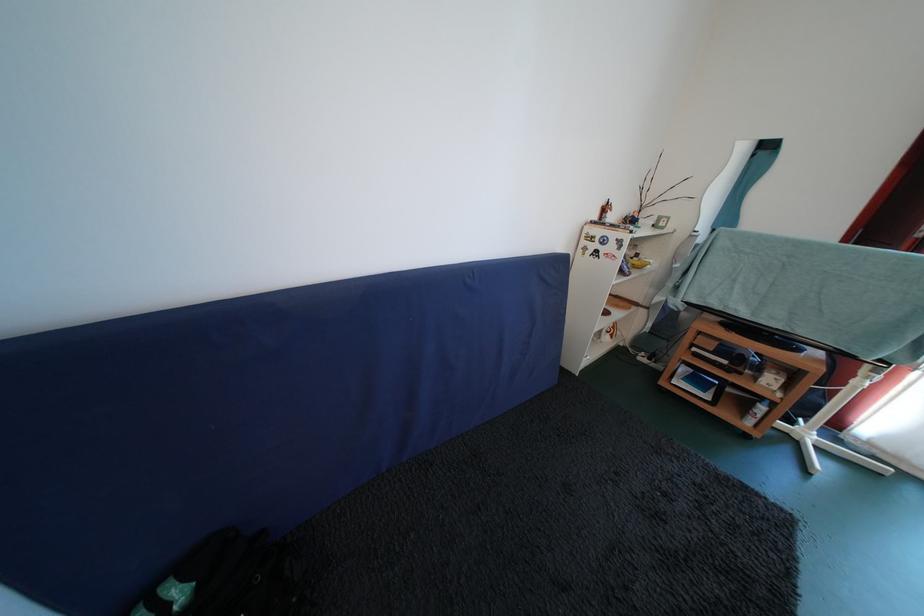
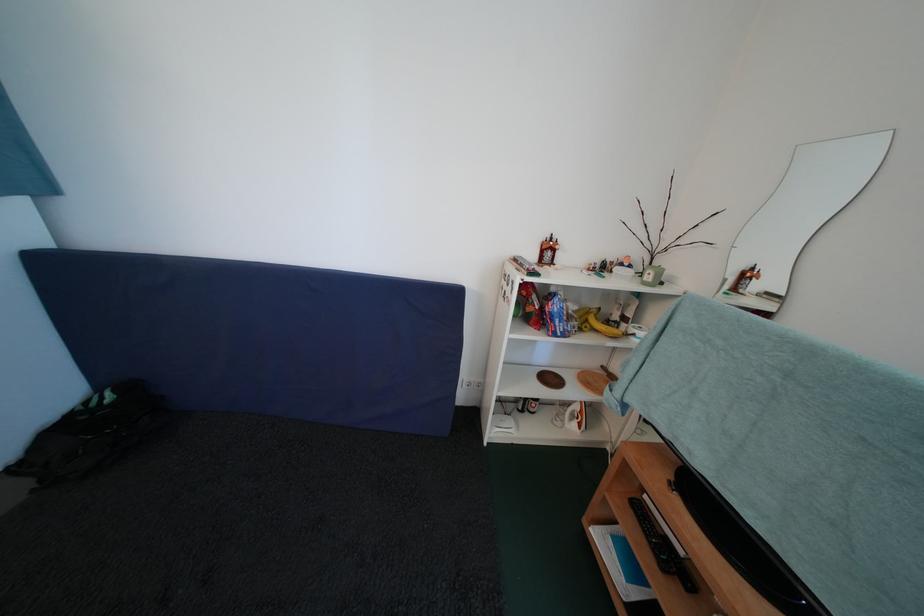
Locate, in the second image, the point that corresponds to point 603,224 in the first image.

(539, 261)